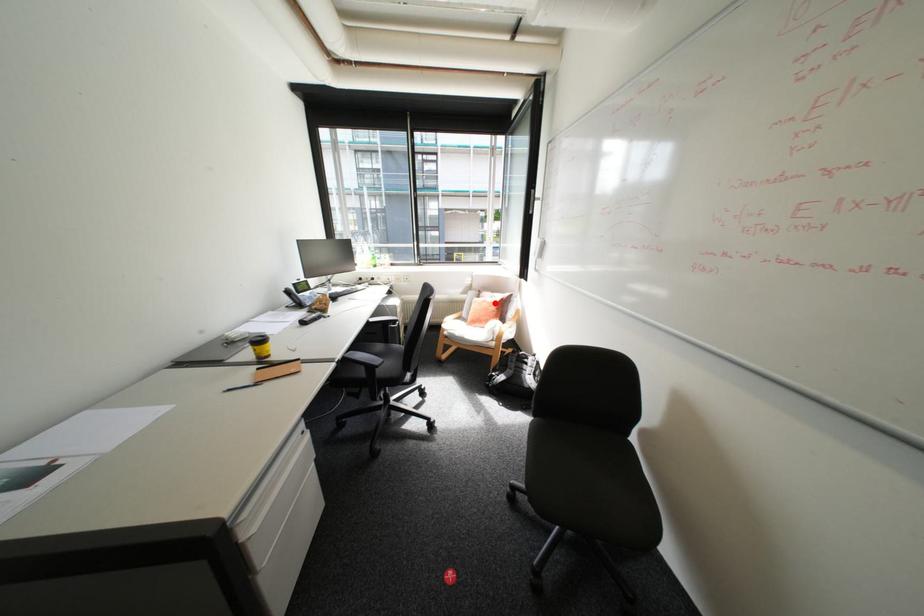
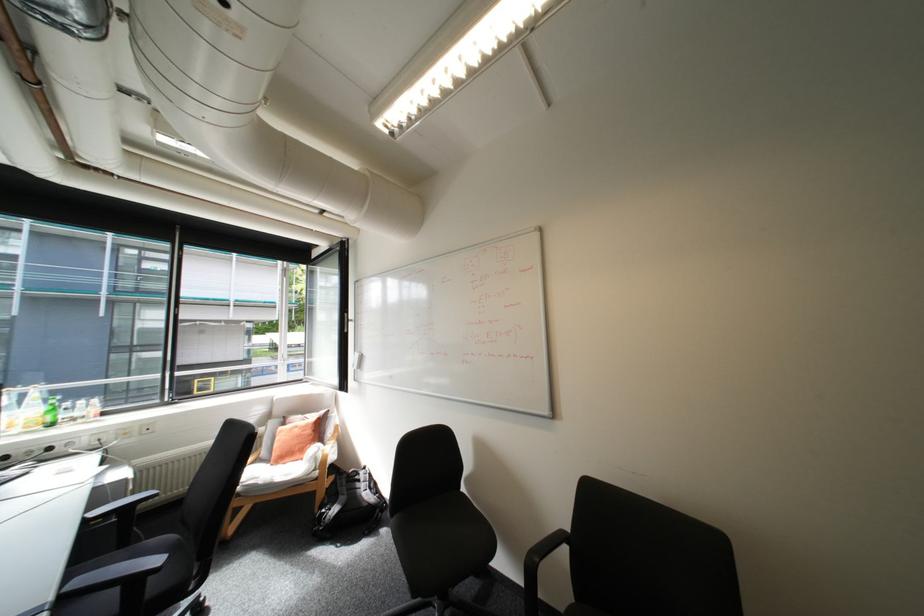
Locate, in the second image, the point that corresponds to the highlighted location in the first image.

(307, 429)